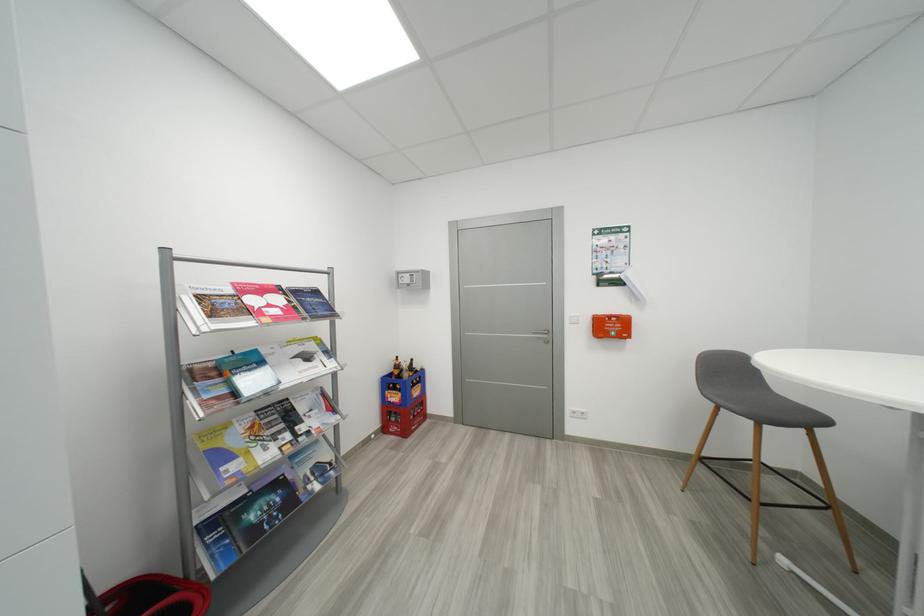
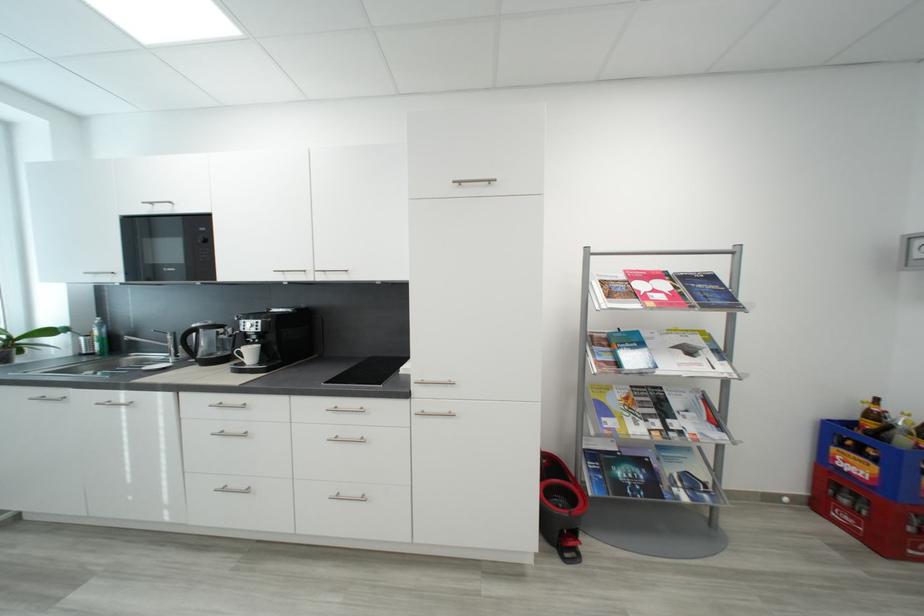
In the second image, find the point that corresponds to (322,294) in the first image.

(718, 280)